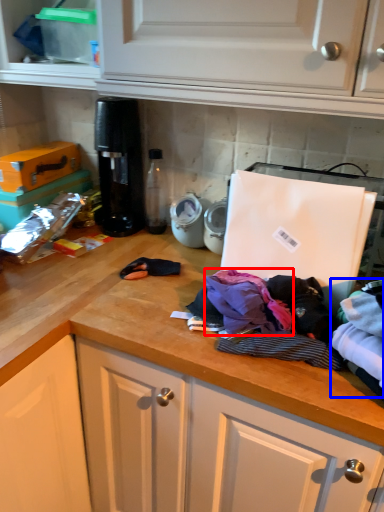
Question: Which object is further to the camera taking this photo, clothing (highlighted by a red box) or clothing (highlighted by a blue box)?

Choices:
 (A) clothing
 (B) clothing

Answer: (A)